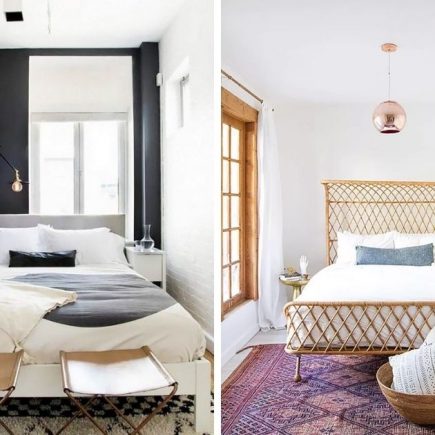
The height and width of the screenshot is (435, 435). Find the location of `black tubelike pillow`. black tubelike pillow is located at coordinates (48, 260).